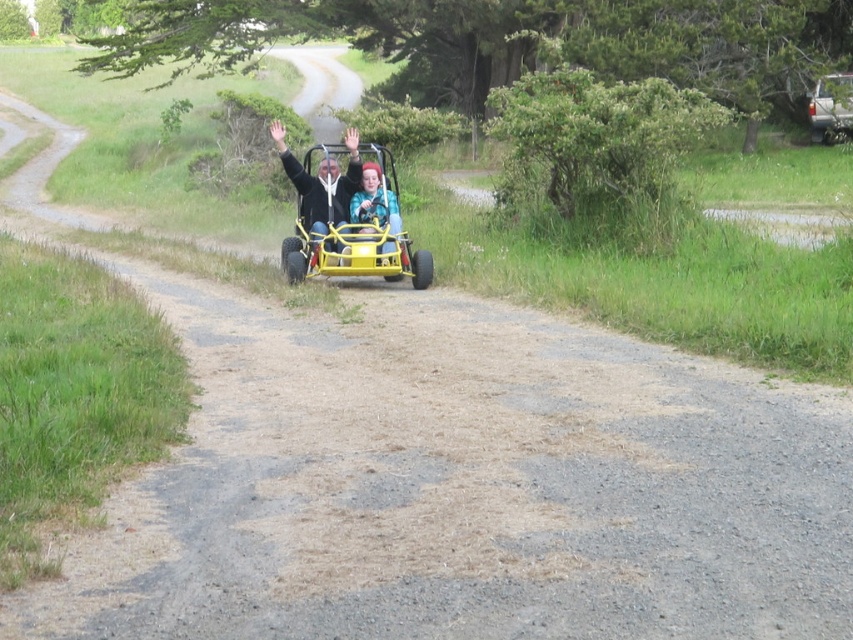
Question: Which point appears closest to the camera in this image?

Choices:
 (A) (386, 186)
 (B) (842, 72)

Answer: (A)

Question: Which object is closer to the camera taking this photo?

Choices:
 (A) matte black jacket at center
 (B) silver metallic truck at upper right

Answer: (A)

Question: Is the position of yellow matte go-kart at center less distant than that of matte black jacket at center?

Choices:
 (A) yes
 (B) no

Answer: (A)

Question: Which point appears farthest from the camera in this image?

Choices:
 (A) (314, 196)
 (B) (824, 109)

Answer: (B)

Question: Does yellow matte go-kart at center have a larger size compared to silver metallic truck at upper right?

Choices:
 (A) no
 (B) yes

Answer: (B)

Question: Is yellow matte go-kart at center wider than silver metallic truck at upper right?

Choices:
 (A) yes
 (B) no

Answer: (A)